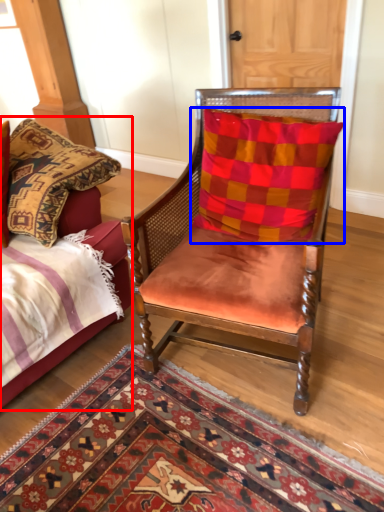
Question: Which of the following is the closest to the observer, bed (highlighted by a red box) or pillow (highlighted by a blue box)?

Choices:
 (A) bed
 (B) pillow

Answer: (A)